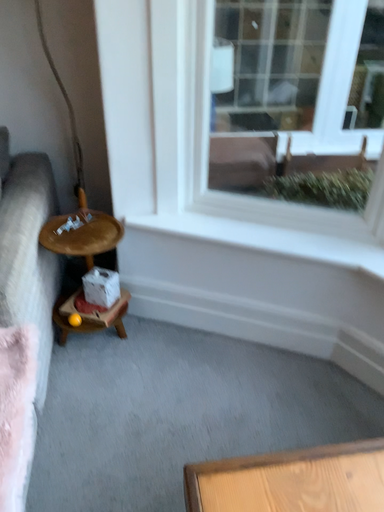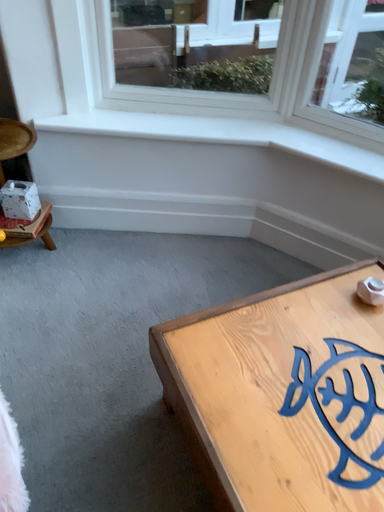
Question: How did the camera likely rotate when shooting the video?

Choices:
 (A) rotated right
 (B) rotated left

Answer: (A)